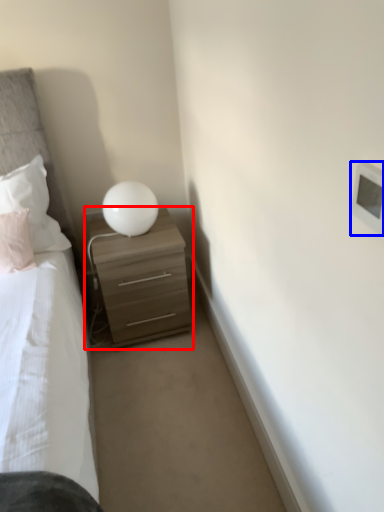
Question: Which object appears farthest to the camera in this image, nightstand (highlighted by a red box) or light switch (highlighted by a blue box)?

Choices:
 (A) nightstand
 (B) light switch

Answer: (A)